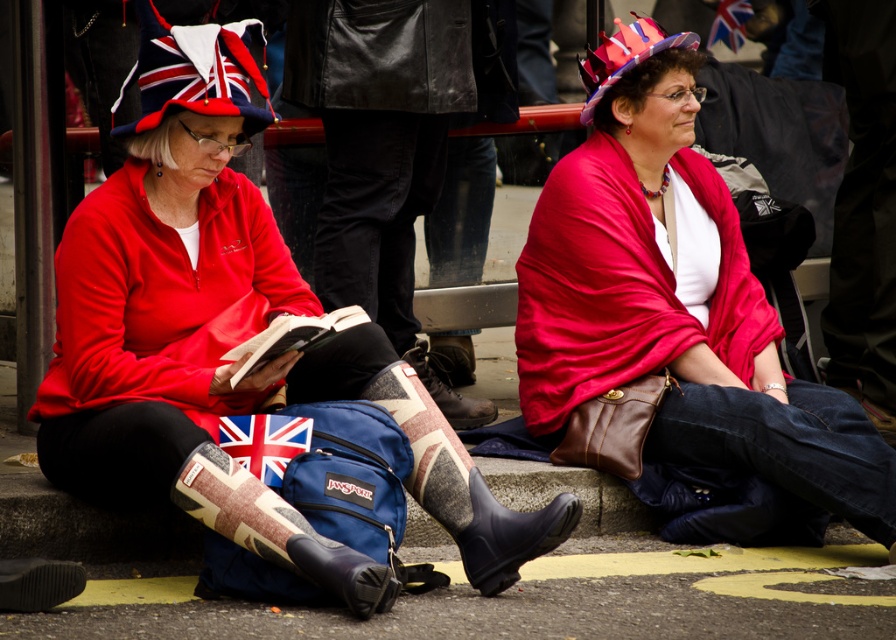
Question: Can you confirm if matte black jacket at center is positioned to the right of union jack flag at upper center?

Choices:
 (A) no
 (B) yes

Answer: (A)

Question: Which object is the farthest from the union jack fabric at center?

Choices:
 (A) camouflage-patterned rubber boot at center
 (B) matte red scarf at center
 (C) matte black jacket at center

Answer: (B)

Question: Among these points, which one is nearest to the camera?

Choices:
 (A) (237, 454)
 (B) (162, 228)

Answer: (A)

Question: Which object is farther from the camera taking this photo?

Choices:
 (A) matte red scarf at center
 (B) union jack fabric at center
 (C) union jack flag at upper center
 (D) camouflage-patterned rubber boot at center

Answer: (C)

Question: Does matte red scarf at center have a lesser width compared to camouflage-patterned rubber boot at center?

Choices:
 (A) no
 (B) yes

Answer: (A)

Question: Can you confirm if matte black jacket at center is wider than camouflage-patterned rubber boot at center?

Choices:
 (A) yes
 (B) no

Answer: (A)